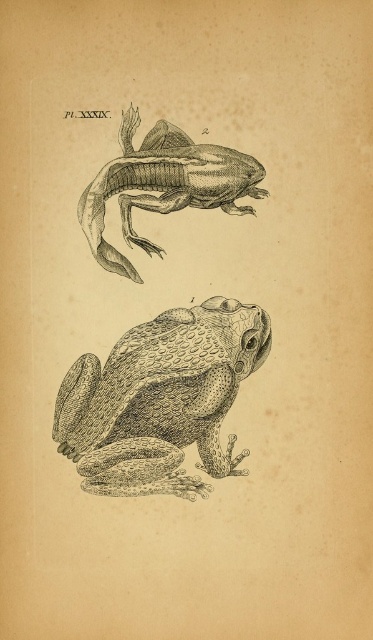
Question: Which point is closer to the camera taking this photo?

Choices:
 (A) (86, 387)
 (B) (140, 202)

Answer: (A)

Question: Is etched paper frog at center smaller than etched paper frog at upper center?

Choices:
 (A) no
 (B) yes

Answer: (A)

Question: Does etched paper frog at center appear on the left side of etched paper frog at upper center?

Choices:
 (A) yes
 (B) no

Answer: (B)

Question: Is etched paper frog at center bigger than etched paper frog at upper center?

Choices:
 (A) no
 (B) yes

Answer: (B)